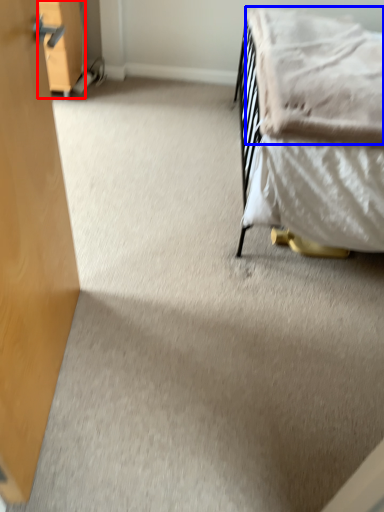
Question: Among these objects, which one is nearest to the camera, drawer (highlighted by a red box) or blanket (highlighted by a blue box)?

Choices:
 (A) drawer
 (B) blanket

Answer: (B)